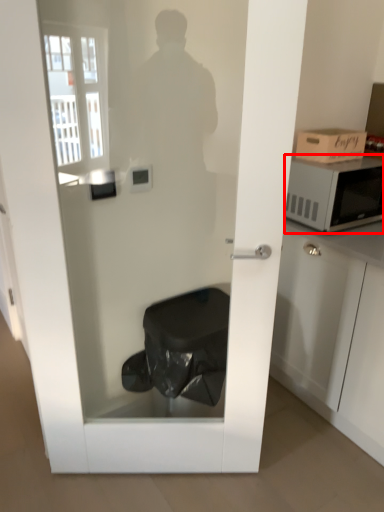
Question: From the image's perspective, considering the relative positions of microwave oven (annotated by the red box) and cardboard box in the image provided, where is microwave oven (annotated by the red box) located with respect to the staircase?

Choices:
 (A) above
 (B) below

Answer: (B)